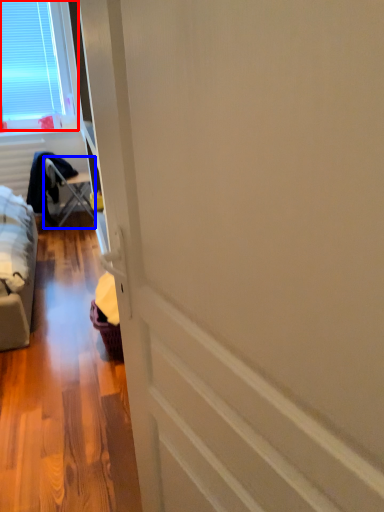
Question: Which point is closer to the camera, window (highlighted by a red box) or furniture (highlighted by a blue box)?

Choices:
 (A) window
 (B) furniture

Answer: (A)